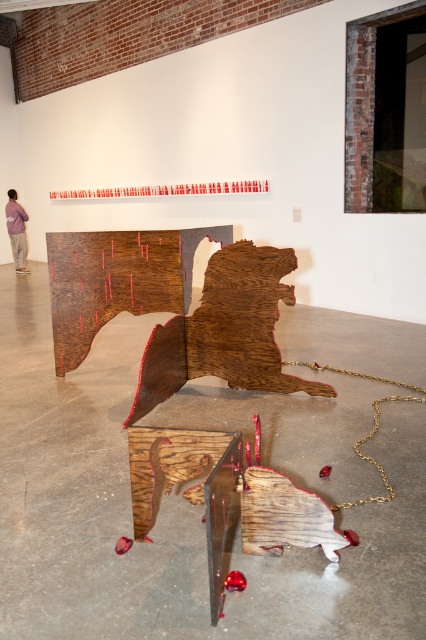
Question: Can you confirm if wooden sculpture at center is positioned below wooden carving at center?

Choices:
 (A) no
 (B) yes

Answer: (B)

Question: Among these objects, which one is nearest to the camera?

Choices:
 (A) wooden carving at center
 (B) purple cotton shirt at upper left

Answer: (A)

Question: Which point is closer to the camera taking this photo?

Choices:
 (A) (19, 211)
 (B) (291, 253)

Answer: (B)

Question: In this image, where is wooden carving at center located relative to purple cotton shirt at upper left?

Choices:
 (A) below
 (B) above

Answer: (A)

Question: Which of the following is the closest to the observer?

Choices:
 (A) wooden sculpture at center
 (B) wooden carving at center
 (C) purple cotton shirt at upper left

Answer: (A)

Question: Is wooden sculpture at center further to camera compared to wooden carving at center?

Choices:
 (A) yes
 (B) no

Answer: (B)